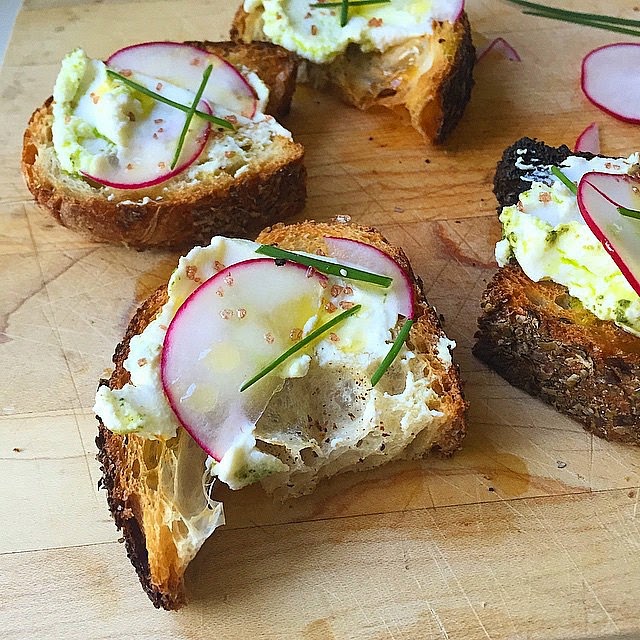
Find the location of a particular element. The width and height of the screenshot is (640, 640). table is located at coordinates (253, 572).